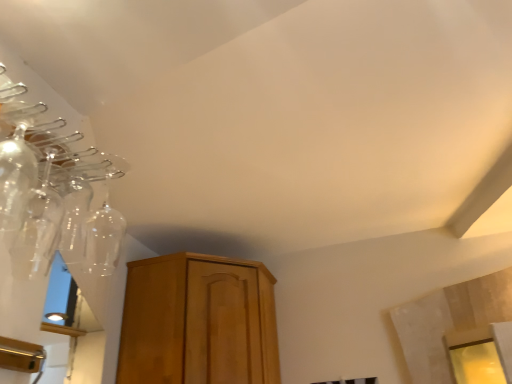
Question: Is transparent glass bottle at upper left, the 1th glass bottle when ordered from back to front, at the right side of transparent glass bottle at left, acting as the 1th glass bottle starting from the front?

Choices:
 (A) yes
 (B) no

Answer: (A)

Question: From the image's perspective, is transparent glass bottle at upper left, which is the 2th glass bottle in front-to-back order, on top of transparent glass bottle at left, marked as the second glass bottle in a back-to-front arrangement?

Choices:
 (A) yes
 (B) no

Answer: (B)

Question: Does transparent glass bottle at upper left, the 1th glass bottle when ordered from back to front, have a larger size compared to transparent glass bottle at left, marked as the second glass bottle in a back-to-front arrangement?

Choices:
 (A) no
 (B) yes

Answer: (B)

Question: Does transparent glass bottle at upper left, the 1th glass bottle when ordered from back to front, touch transparent glass bottle at left, acting as the 1th glass bottle starting from the front?

Choices:
 (A) yes
 (B) no

Answer: (A)

Question: Is transparent glass bottle at upper left, the 1th glass bottle when ordered from back to front, turned away from transparent glass bottle at left, marked as the second glass bottle in a back-to-front arrangement?

Choices:
 (A) no
 (B) yes

Answer: (A)

Question: Does transparent glass bottle at upper left, the 1th glass bottle when ordered from back to front, have a greater height compared to transparent glass bottle at left, marked as the second glass bottle in a back-to-front arrangement?

Choices:
 (A) no
 (B) yes

Answer: (B)

Question: From the image's perspective, is transparent glass bottle at left, acting as the 1th glass bottle starting from the front, located beneath transparent glass bottle at upper left, which is the 2th glass bottle in front-to-back order?

Choices:
 (A) no
 (B) yes

Answer: (A)

Question: Does transparent glass bottle at left, marked as the second glass bottle in a back-to-front arrangement, appear on the right side of transparent glass bottle at upper left, which is the 2th glass bottle in front-to-back order?

Choices:
 (A) no
 (B) yes

Answer: (A)

Question: From a real-world perspective, is transparent glass bottle at left, acting as the 1th glass bottle starting from the front, positioned under transparent glass bottle at upper left, the 1th glass bottle when ordered from back to front, based on gravity?

Choices:
 (A) no
 (B) yes

Answer: (B)

Question: Is transparent glass bottle at left, marked as the second glass bottle in a back-to-front arrangement, shorter than transparent glass bottle at upper left, which is the 2th glass bottle in front-to-back order?

Choices:
 (A) yes
 (B) no

Answer: (A)

Question: Would you say transparent glass bottle at upper left, which is the 2th glass bottle in front-to-back order, is part of transparent glass bottle at left, marked as the second glass bottle in a back-to-front arrangement,'s contents?

Choices:
 (A) no
 (B) yes

Answer: (A)

Question: Does transparent glass bottle at left, marked as the second glass bottle in a back-to-front arrangement, have a smaller size compared to transparent glass bottle at upper left, which is the 2th glass bottle in front-to-back order?

Choices:
 (A) yes
 (B) no

Answer: (A)

Question: Is transparent glass bottle at left, marked as the second glass bottle in a back-to-front arrangement, spatially inside transparent glass bottle at upper left, which is the 2th glass bottle in front-to-back order, or outside of it?

Choices:
 (A) inside
 (B) outside

Answer: (B)